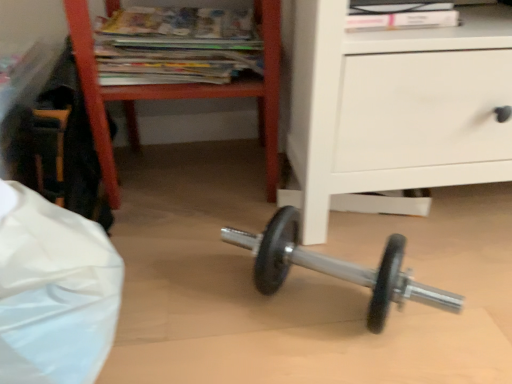
Question: From the image's perspective, is matte paper magazines at upper center above wooden magazine rack at upper left?

Choices:
 (A) no
 (B) yes

Answer: (B)

Question: Does matte paper magazines at upper center contain wooden magazine rack at upper left?

Choices:
 (A) no
 (B) yes

Answer: (A)

Question: Does matte paper magazines at upper center lie behind wooden magazine rack at upper left?

Choices:
 (A) yes
 (B) no

Answer: (A)

Question: Considering the relative sizes of matte paper magazines at upper center and wooden magazine rack at upper left in the image provided, is matte paper magazines at upper center wider than wooden magazine rack at upper left?

Choices:
 (A) no
 (B) yes

Answer: (A)

Question: Would you say matte paper magazines at upper center is outside wooden magazine rack at upper left?

Choices:
 (A) yes
 (B) no

Answer: (B)

Question: Considering the relative sizes of matte paper magazines at upper center and wooden magazine rack at upper left in the image provided, is matte paper magazines at upper center taller than wooden magazine rack at upper left?

Choices:
 (A) yes
 (B) no

Answer: (B)

Question: Is wooden magazine rack at upper left oriented towards matte paper magazines at upper center?

Choices:
 (A) no
 (B) yes

Answer: (B)

Question: Can you confirm if wooden magazine rack at upper left is shorter than matte paper magazines at upper center?

Choices:
 (A) yes
 (B) no

Answer: (B)

Question: Is wooden magazine rack at upper left at the right side of matte paper magazines at upper center?

Choices:
 (A) yes
 (B) no

Answer: (A)

Question: Considering the relative sizes of wooden magazine rack at upper left and matte paper magazines at upper center in the image provided, is wooden magazine rack at upper left taller than matte paper magazines at upper center?

Choices:
 (A) yes
 (B) no

Answer: (A)

Question: Can you confirm if wooden magazine rack at upper left is smaller than matte paper magazines at upper center?

Choices:
 (A) no
 (B) yes

Answer: (A)

Question: From the image's perspective, is wooden magazine rack at upper left beneath matte paper magazines at upper center?

Choices:
 (A) no
 (B) yes

Answer: (B)

Question: From the image's perspective, is wooden magazine rack at upper left located above or below matte paper magazines at upper center?

Choices:
 (A) above
 (B) below

Answer: (B)